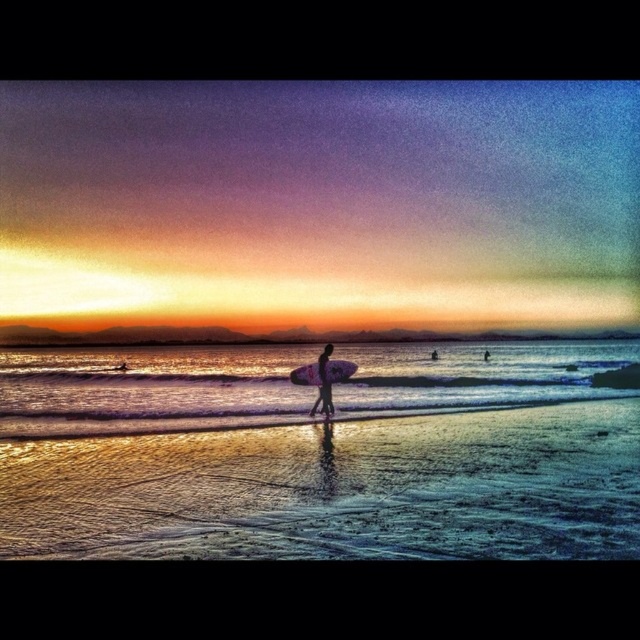
You are a photographer trying to capture the sunset. You notice the shiny silver water at center and the white foam surfboard at center in your frame. Which object should you focus on if you want to highlight the larger subject in the scene?

The shiny silver water at center is bigger than the white foam surfboard at center, so you should focus on the shiny silver water at center to highlight the larger subject.